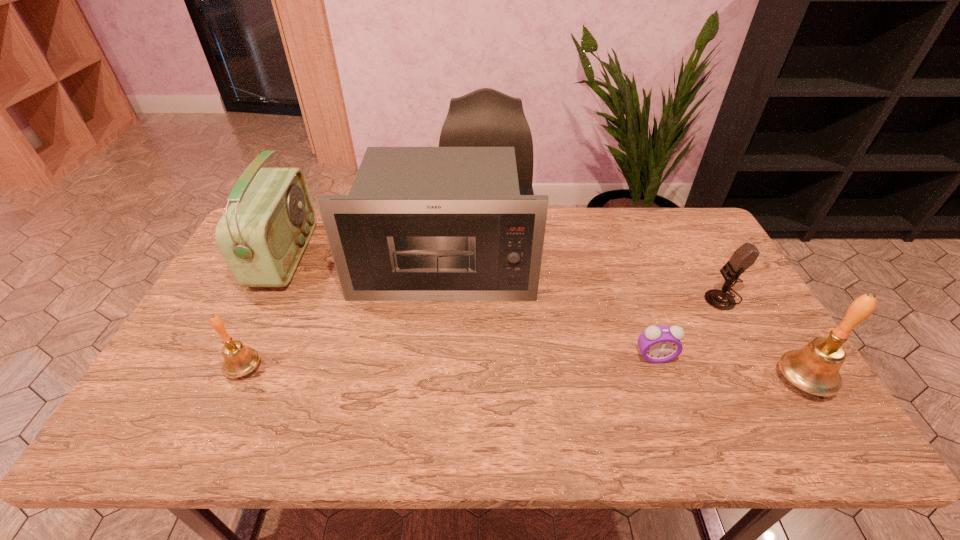
To make them evenly spaced by inserting another bell among them, please locate a free space for this new bell. Please provide its 2D coordinates. Your answer should be formatted as a tuple, i.e. [(x, y)], where the tuple contains the x and y coordinates of a point satisfying the conditions above.

[(520, 374)]